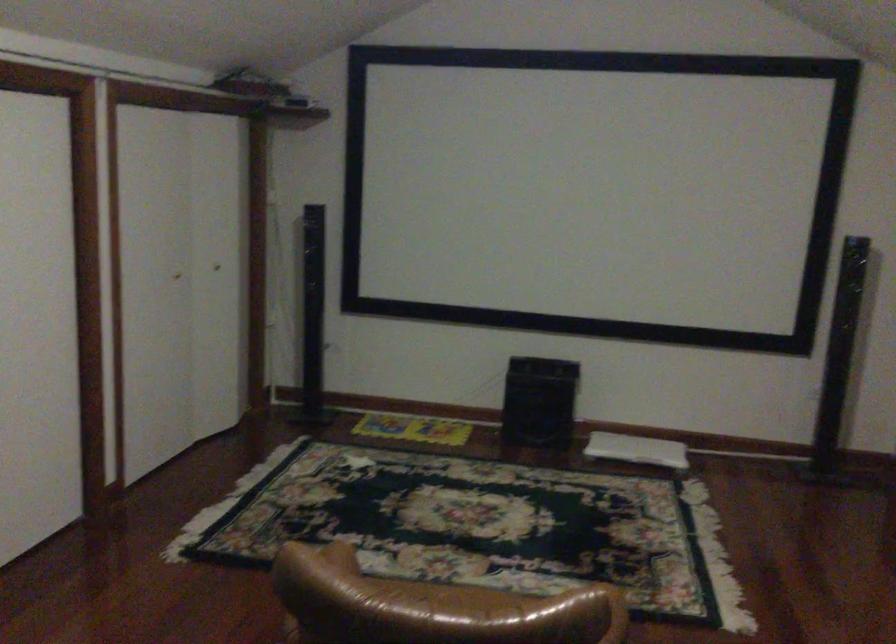
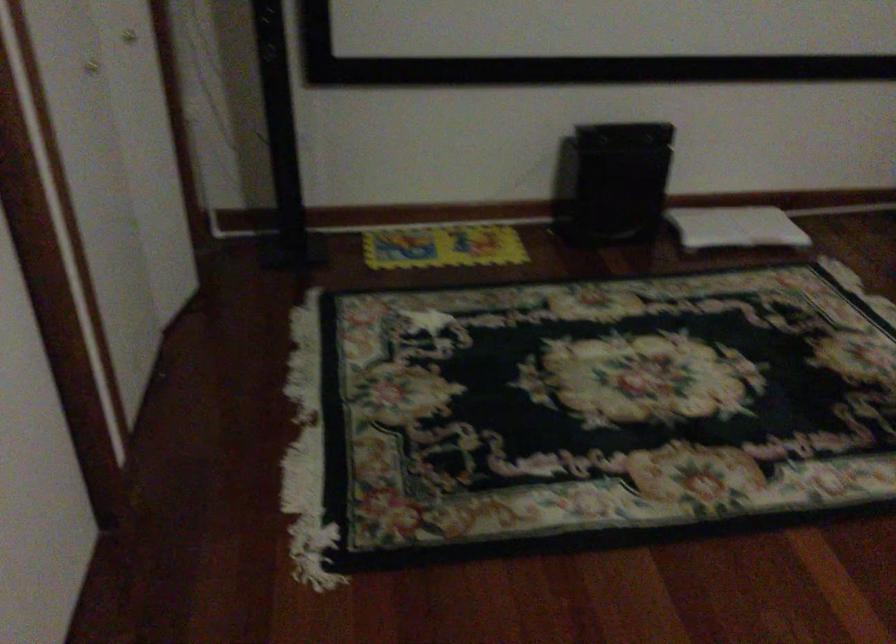
Which direction would the cameraman need to move to produce the second image?

The cameraman moved toward left, forward.